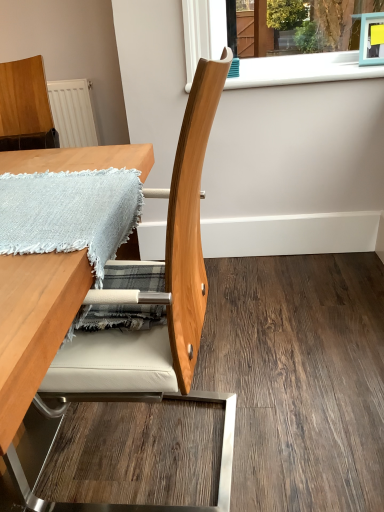
Question: Can you see light blue woven blanket at upper left touching white plastic window sill at upper center?

Choices:
 (A) no
 (B) yes

Answer: (A)

Question: Is light blue woven blanket at upper left not near white plastic window sill at upper center?

Choices:
 (A) no
 (B) yes

Answer: (B)

Question: From a real-world perspective, does light blue woven blanket at upper left sit lower than white plastic window sill at upper center?

Choices:
 (A) yes
 (B) no

Answer: (A)

Question: From the image's perspective, would you say light blue woven blanket at upper left is shown under white plastic window sill at upper center?

Choices:
 (A) yes
 (B) no

Answer: (A)

Question: Is light blue woven blanket at upper left outside white plastic window sill at upper center?

Choices:
 (A) no
 (B) yes

Answer: (B)

Question: Is wooden chair at center spatially inside light blue woven blanket at upper left, or outside of it?

Choices:
 (A) outside
 (B) inside

Answer: (A)

Question: Considering the positions of wooden chair at center and light blue woven blanket at upper left in the image, is wooden chair at center taller or shorter than light blue woven blanket at upper left?

Choices:
 (A) short
 (B) tall

Answer: (B)

Question: Considering the relative positions of wooden chair at center and light blue woven blanket at upper left in the image provided, is wooden chair at center to the left or to the right of light blue woven blanket at upper left?

Choices:
 (A) left
 (B) right

Answer: (B)

Question: From a real-world perspective, is wooden chair at center above or below light blue woven blanket at upper left?

Choices:
 (A) above
 (B) below

Answer: (B)

Question: From a real-world perspective, relative to natural wood chair at center, is wooden table at center vertically above or below?

Choices:
 (A) above
 (B) below

Answer: (A)

Question: From the image's perspective, is wooden table at center above or below natural wood chair at center?

Choices:
 (A) above
 (B) below

Answer: (A)

Question: Would you say wooden table at center is to the left or to the right of natural wood chair at center in the picture?

Choices:
 (A) right
 (B) left

Answer: (B)

Question: Is wooden table at center wider or thinner than natural wood chair at center?

Choices:
 (A) wide
 (B) thin

Answer: (B)

Question: Based on their positions, is wooden chair at center located to the left or right of wooden table at center?

Choices:
 (A) right
 (B) left

Answer: (A)

Question: Is wooden chair at center wider or thinner than wooden table at center?

Choices:
 (A) thin
 (B) wide

Answer: (A)